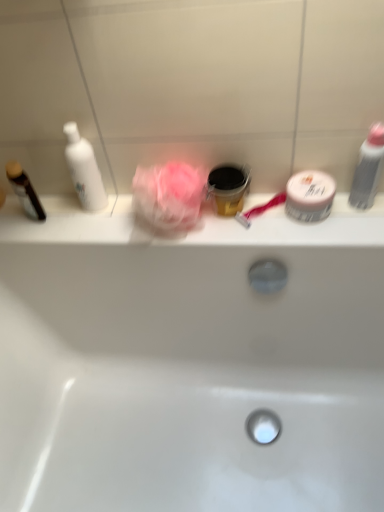
Find the location of a particular element. free space in front of black plastic cup at center, which is counted as the second toiletry, starting from the left is located at coordinates (240, 234).